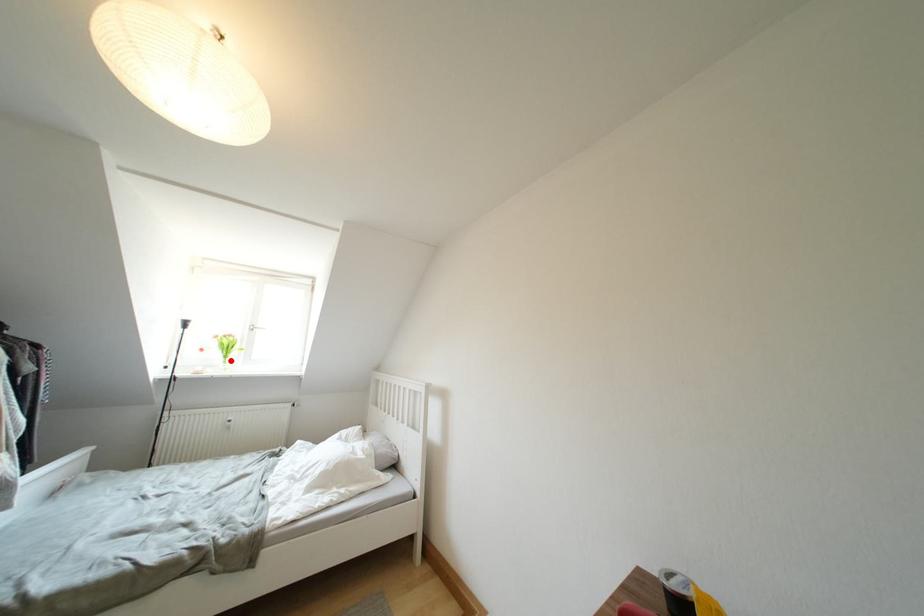
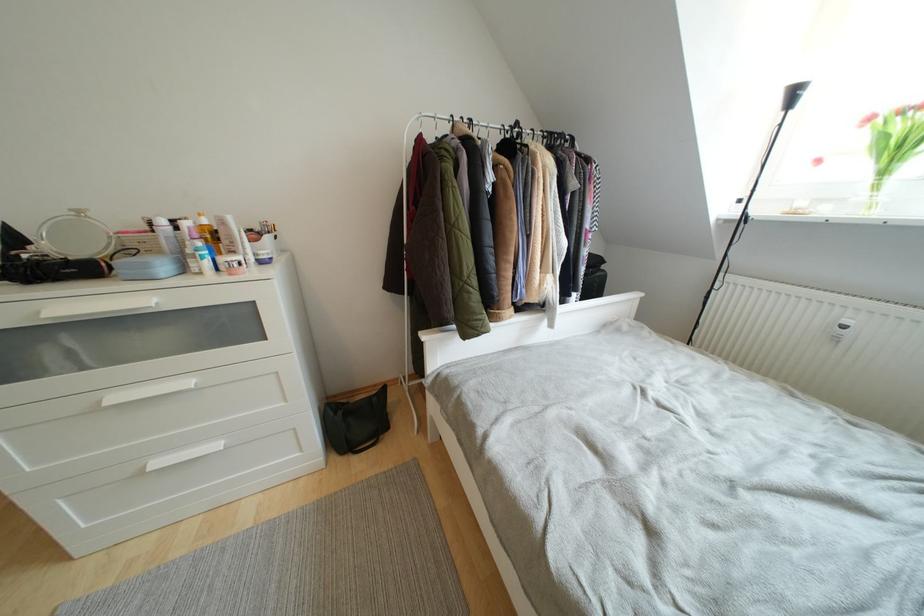
Question: I am providing you with two images of the same scene from different viewpoints. A red point is shown in image1. For the corresponding object point in image2, is it positioned nearer or farther from the camera?

Choices:
 (A) Nearer
 (B) Farther

Answer: (B)